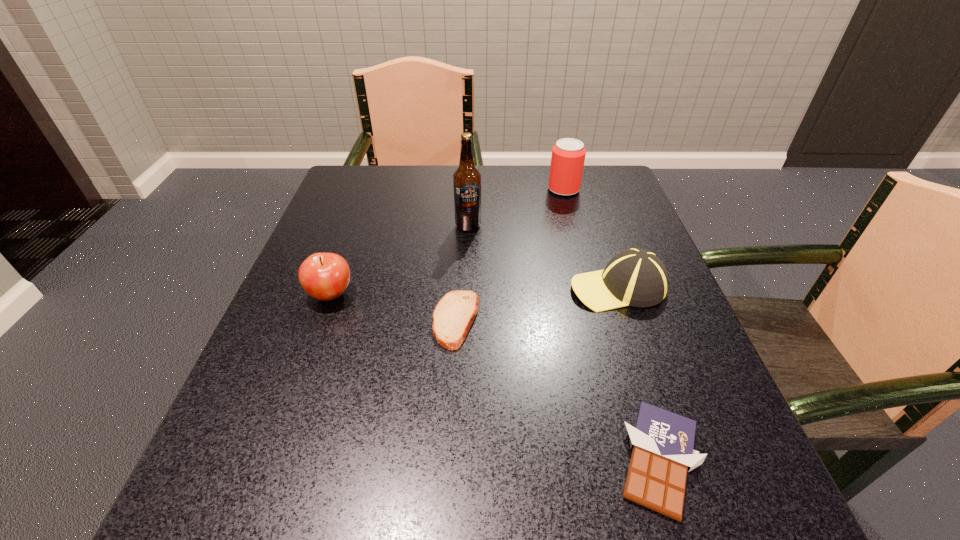
Choose which object is the nearest neighbor to the leftmost object. Please provide its 2D coordinates. Your answer should be formatted as a tuple, i.e. [(x, y)], where the tuple contains the x and y coordinates of a point satisfying the conditions above.

[(453, 316)]

Select which object appears as the closest to the pita bread. Please provide its 2D coordinates. Your answer should be formatted as a tuple, i.e. [(x, y)], where the tuple contains the x and y coordinates of a point satisfying the conditions above.

[(324, 276)]

You are a GUI agent. You are given a task and a screenshot of the screen. Output one action in this format:
    pyautogui.click(x=<x>, y=<y>)
    Task: Click on the free space that satisfies the following two spatial constraints: 1. on the back side of the leftmost object; 2. on the right side of the farthest object
    This screenshot has width=960, height=540.
    Given the screenshot: What is the action you would take?
    pyautogui.click(x=369, y=190)

Identify the location of vacant space that satisfies the following two spatial constraints: 1. on the label of the chocolate bar; 2. on the right side of the beer bottle. The image size is (960, 540). (460, 460).

The image size is (960, 540). Find the location of `blank area in the image that satisfies the following two spatial constraints: 1. with the brim of the baseball cap facing forward; 2. on the front side of the pita bread`. blank area in the image that satisfies the following two spatial constraints: 1. with the brim of the baseball cap facing forward; 2. on the front side of the pita bread is located at coordinates (629, 320).

The width and height of the screenshot is (960, 540). I want to click on blank area in the image that satisfies the following two spatial constraints: 1. on the label of the beer bottle; 2. on the left side of the nearest object, so click(460, 460).